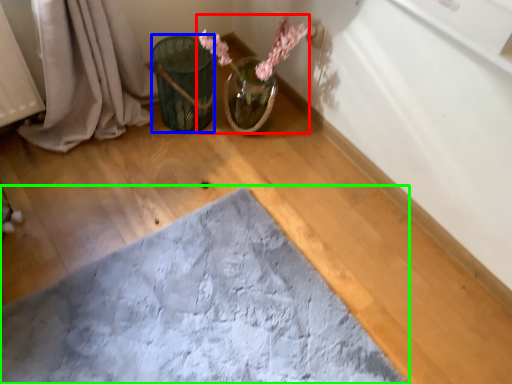
Question: Estimate the real-world distances between objects in this image. Which object is closer to floral arrangement (highlighted by a red box), flower basket (highlighted by a blue box) or bath mat (highlighted by a green box)?

Choices:
 (A) flower basket
 (B) bath mat

Answer: (A)